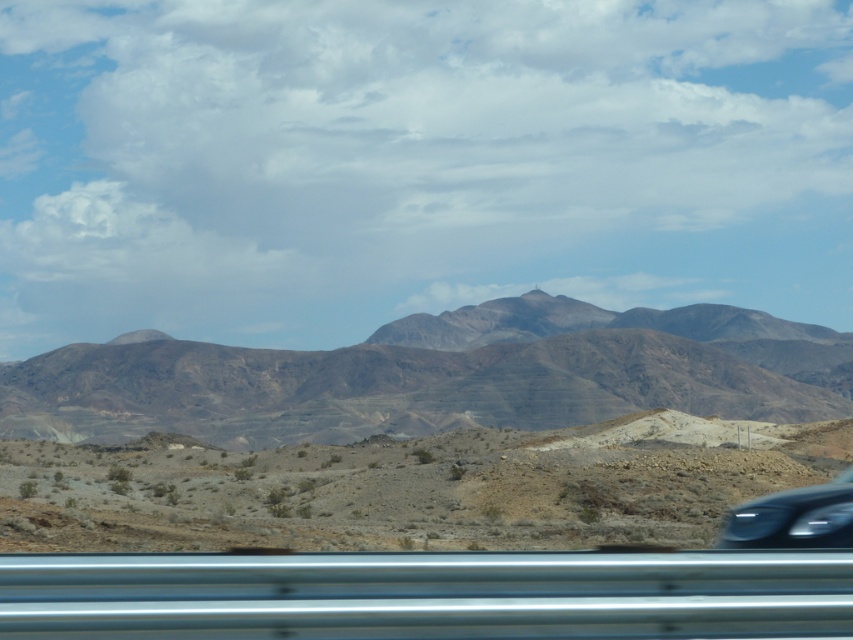
Based on the photo, you are a hiker planning to cross the desert at center. You see the brown rocky mountain range at center in the distance. Which direction should you head to avoid climbing the mountain?

The desert at center is located below the brown rocky mountain range at center, so heading downward from the mountain range would keep you on the desert terrain and avoid climbing.

You are standing at the guardrail in the desert scene. Looking towards the center of the image, what geographical feature is indicated by the point labeled at coordinates (438, 376)?

The point labeled at coordinates (438, 376) marks the brown rocky mountain range at center.

You are a driver approaching a desert highway and see the brown rocky mountain range at center and the sleek black car at lower right. Which object is positioned to the left side from your perspective?

The brown rocky mountain range at center is to the left of the sleek black car at lower right, so it is positioned to the left side from your perspective.